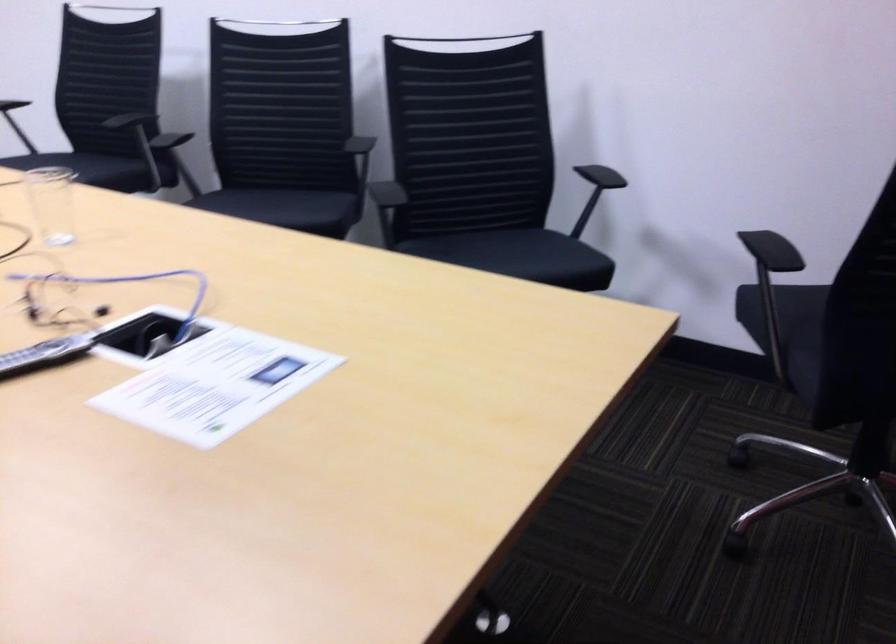
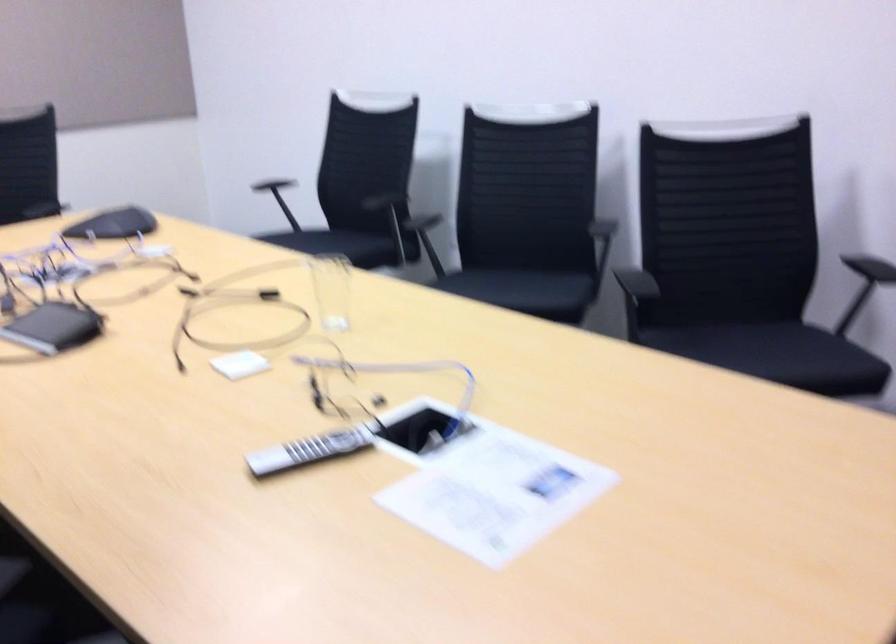
Question: Based on the continuous images, in which direction is the camera rotating? Reply with the corresponding letter.

Choices:
 (A) Left
 (B) Right
 (C) Up
 (D) Down

Answer: (A)